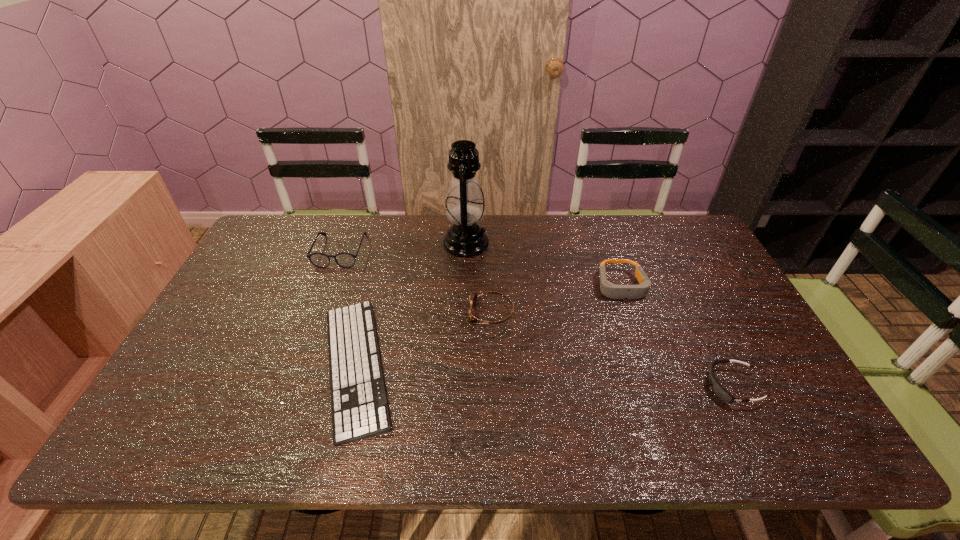
Find the location of a particular element. free space between the nearest goggles and the third tallest object is located at coordinates (677, 336).

The height and width of the screenshot is (540, 960). Identify the location of vacant region between the rightmost object and the spectacles. (537, 319).

In order to click on vacant point located between the tallest object and the nearest goggles in this screenshot , I will do `click(599, 315)`.

Where is `vacant space that's between the tallest goggles and the leftmost goggles`? This screenshot has height=540, width=960. vacant space that's between the tallest goggles and the leftmost goggles is located at coordinates (556, 299).

Locate an element on the screen. The width and height of the screenshot is (960, 540). empty space between the shortest object and the leftmost goggles is located at coordinates [423, 339].

Find the location of a particular element. Image resolution: width=960 pixels, height=540 pixels. unoccupied area between the spectacles and the leftmost goggles is located at coordinates (416, 282).

The width and height of the screenshot is (960, 540). Identify the location of unoccupied area between the rightmost goggles and the oil lamp. (x=599, y=315).

I want to click on vacant area that lies between the shortest object and the tallest goggles, so click(489, 326).

Choose which object is the fourth nearest neighbor to the rightmost object. Please provide its 2D coordinates. Your answer should be formatted as a tuple, i.e. [(x, y)], where the tuple contains the x and y coordinates of a point satisfying the conditions above.

[(359, 408)]

At what (x,y) coordinates should I click in order to perform the action: click on the second closest object relative to the tallest object. Please return your answer as a coordinate pair (x, y). This screenshot has width=960, height=540. Looking at the image, I should click on (359, 408).